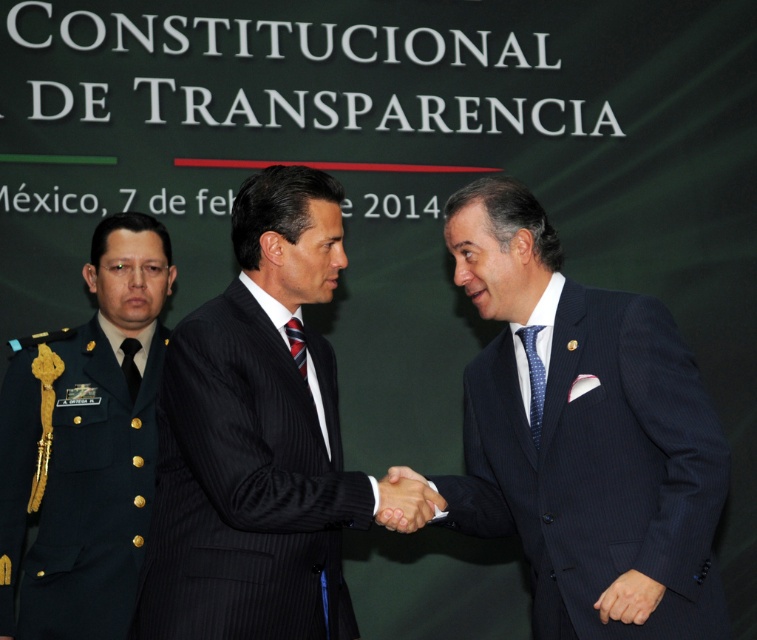
Question: Is green military uniform at left thinner than smooth skin handshake at center?

Choices:
 (A) no
 (B) yes

Answer: (A)

Question: Can you confirm if blue dotted fabric tie at center is positioned below striped fabric tie at center?

Choices:
 (A) yes
 (B) no

Answer: (A)

Question: Based on their relative distances, which object is nearer to the black silk tie at center?

Choices:
 (A) green military uniform at left
 (B) smooth skin handshake at center

Answer: (A)

Question: Is smooth skin handshake at center bigger than striped fabric tie at center?

Choices:
 (A) no
 (B) yes

Answer: (B)

Question: Which of the following is the closest to the observer?

Choices:
 (A) (128, 387)
 (B) (416, 500)

Answer: (B)

Question: Among these objects, which one is nearest to the camera?

Choices:
 (A) black silk tie at center
 (B) dark blue pinstripe suit at center
 (C) blue dotted fabric tie at center

Answer: (B)